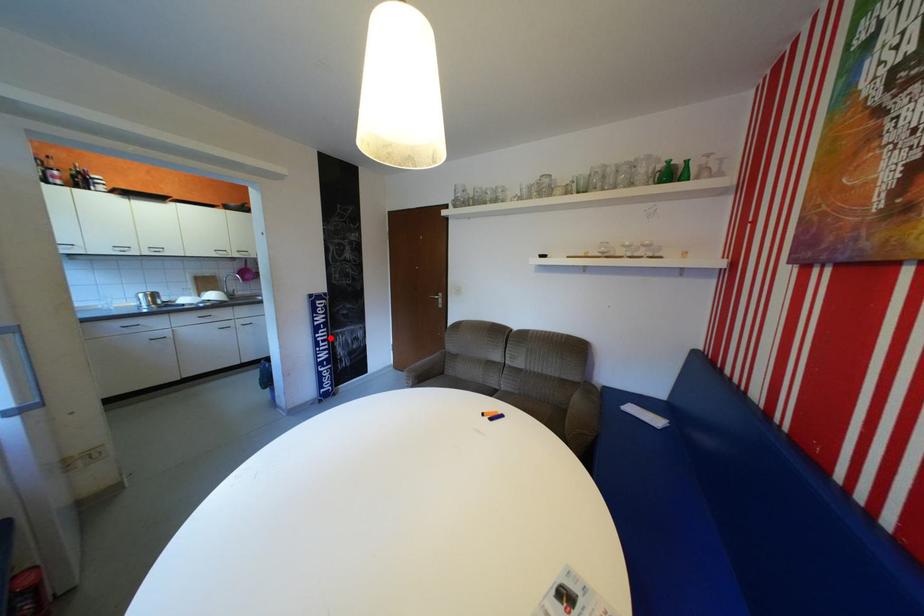
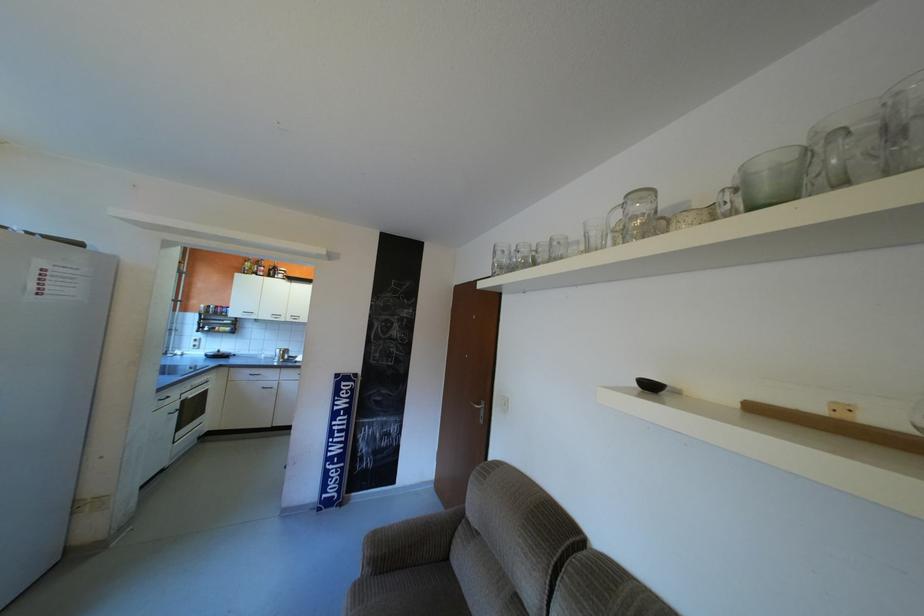
Question: I am providing you with two images of the same scene from different viewpoints. In image1, a red point is highlighted. Considering the same 3D point in image2, which of the following is correct?

Choices:
 (A) It is closer
 (B) It is farther

Answer: (B)